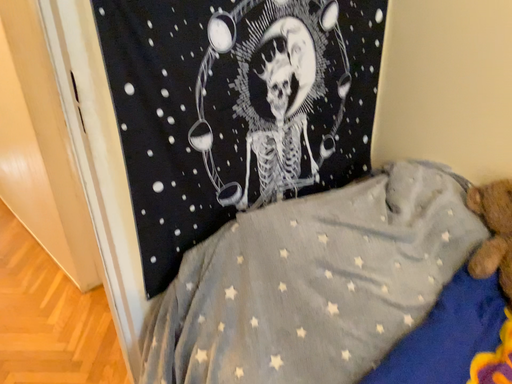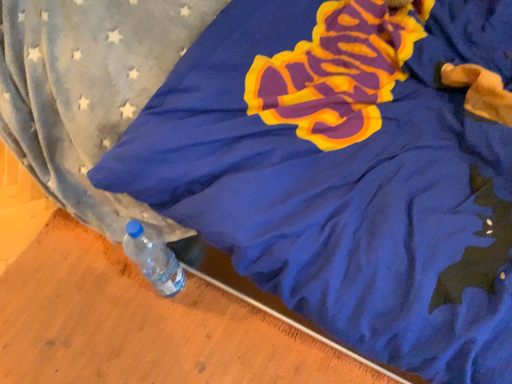
Question: Which way did the camera rotate in the video?

Choices:
 (A) rotated right
 (B) rotated left

Answer: (A)